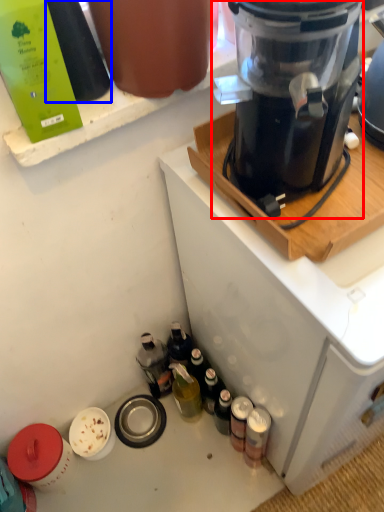
Question: Which object is closer to the camera taking this photo, blender (highlighted by a red box) or bottle (highlighted by a blue box)?

Choices:
 (A) blender
 (B) bottle

Answer: (A)